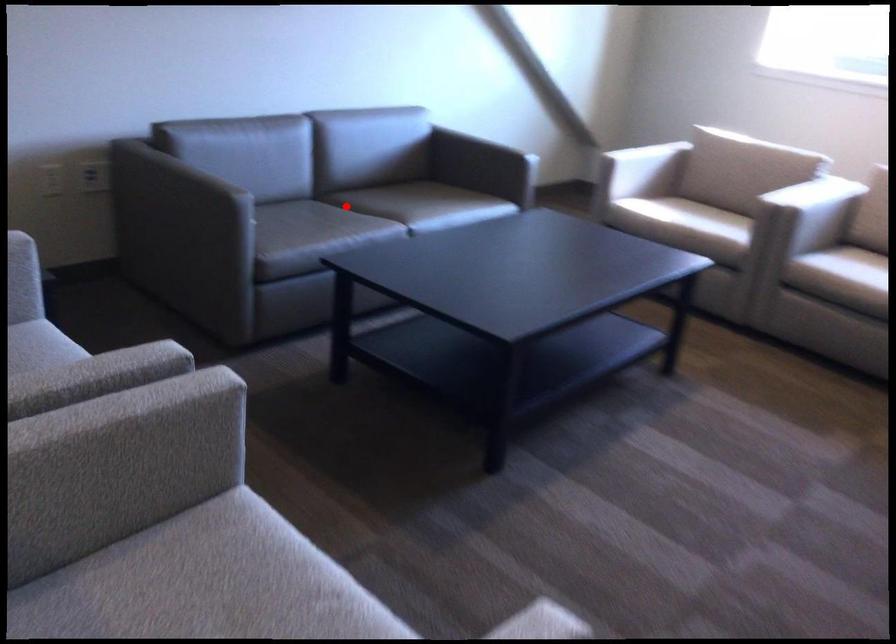
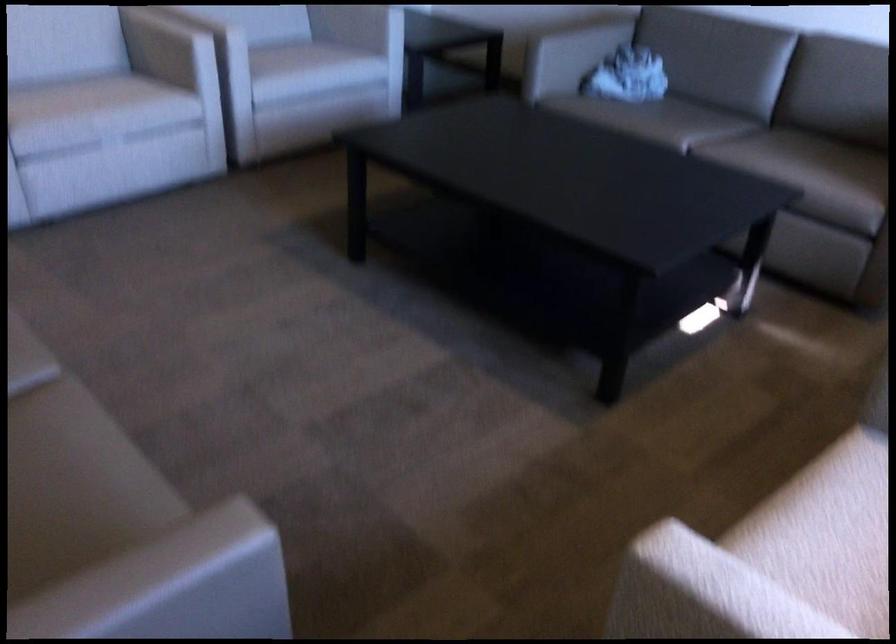
Question: A red point is marked in image1. In image2, is the corresponding 3D point closer to the camera or farther? Reply with the corresponding letter.

Choices:
 (A) The corresponding 3D point is closer.
 (B) The corresponding 3D point is farther.

Answer: (A)